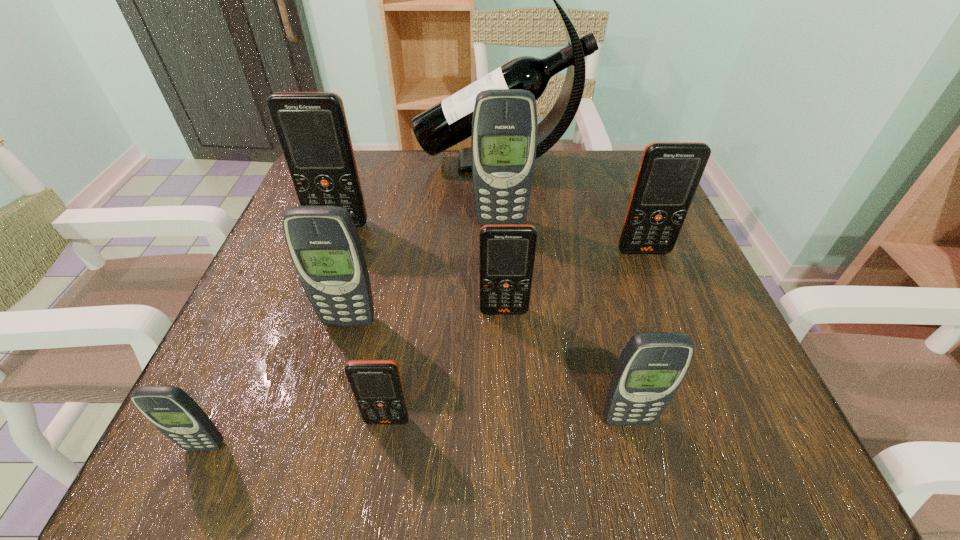
Where is `object at the far right corner`? This screenshot has width=960, height=540. object at the far right corner is located at coordinates (449, 122).

At what (x,y) coordinates should I click in order to perform the action: click on object at the near right corner. Please return your answer as a coordinate pair (x, y). The height and width of the screenshot is (540, 960). Looking at the image, I should click on (652, 366).

Identify the location of blank space at the far edge of the desktop. This screenshot has height=540, width=960. pos(567,164).

Image resolution: width=960 pixels, height=540 pixels. I want to click on vacant space at the near edge, so click(590, 446).

The width and height of the screenshot is (960, 540). Find the location of `vacant point at the left edge`. vacant point at the left edge is located at coordinates (265, 319).

Identify the location of free spot at the right edge of the desktop. The height and width of the screenshot is (540, 960). (708, 330).

In the image, there is a desktop. What are the coordinates of `vacant region at the near left corner` in the screenshot? It's located at (282, 421).

In the image, there is a desktop. Identify the location of blank space at the far right corner. (585, 151).

At what (x,y) coordinates should I click in order to perform the action: click on vacant region between the third orange cellular telephone from right to left and the fourth farthest object. Please return your answer as a coordinate pair (x, y). Looking at the image, I should click on pyautogui.click(x=516, y=336).

The height and width of the screenshot is (540, 960). I want to click on free space between the smallest gray cellular telephone and the third biggest gray cellular telephone, so click(417, 433).